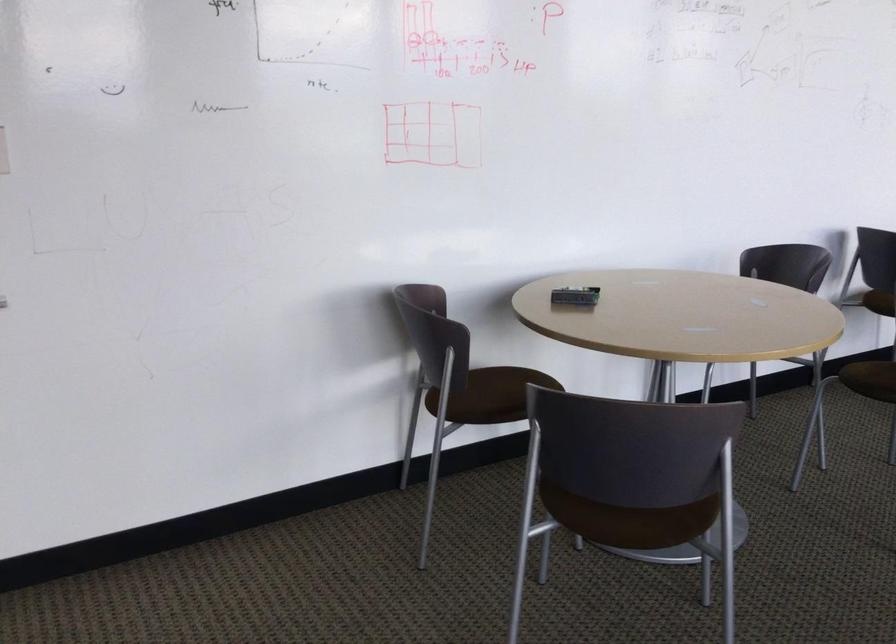
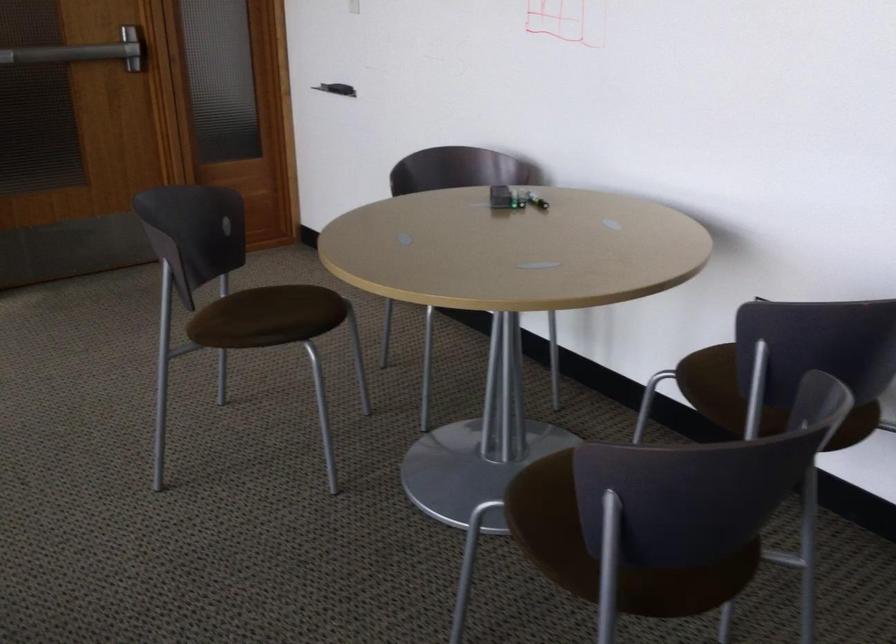
Find the pixel in the second image that matches point 645,482 in the first image.

(276, 317)